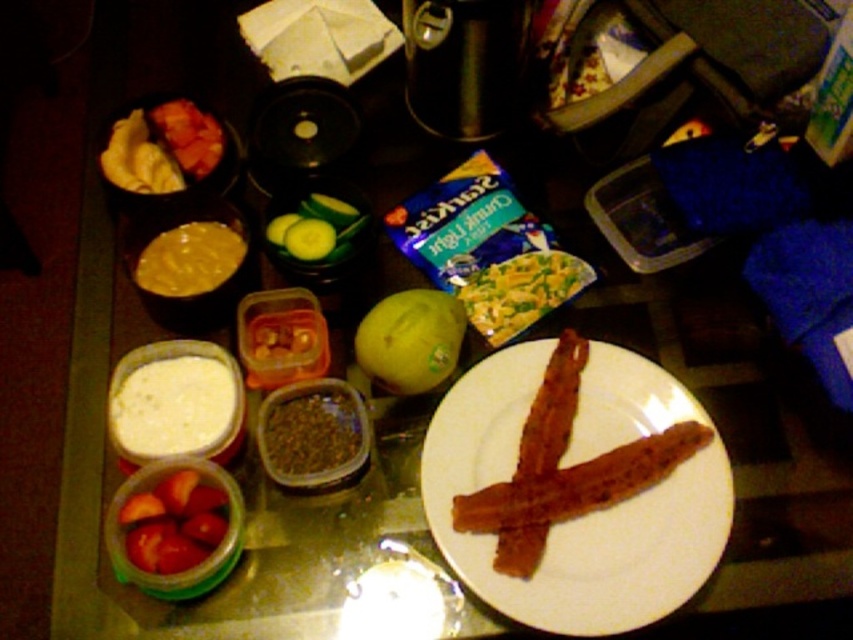
You are preparing a dish and need to sprinkle the green granular spice at center onto the brown crispy bacon at center. Given that the maximum reach of your hand is 6 inches, can you do this without moving either item?

The brown crispy bacon at center is 6.88 inches away from the green granular spice at center. Since your hand can only reach 6 inches, you cannot sprinkle the spice without moving either item.

You are preparing a snack and need to choose between the white creamy spread at lower left and the green granular spice at center. Which one has a bigger container?

The white creamy spread at lower left is larger in size than the green granular spice at center, so the white creamy spread at lower left has a bigger container.

You are organizing the table for a meal and need to place the white creamy spread at lower left and the green granular spice at center. According to the current setup, which item is positioned to the left of the other?

The white creamy spread at lower left is to the left of the green granular spice at center, so the white creamy spread at lower left is positioned to the left of the green granular spice at center.